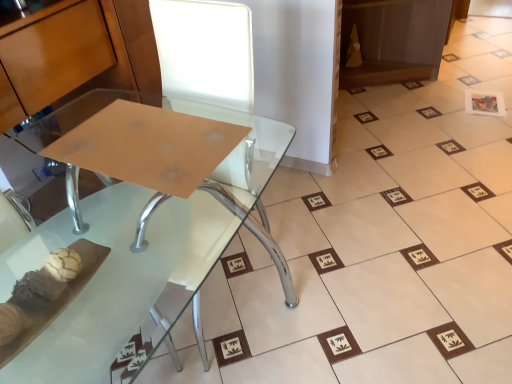
Identify the location of vacant space to the left of white paper at upper right. (449, 108).